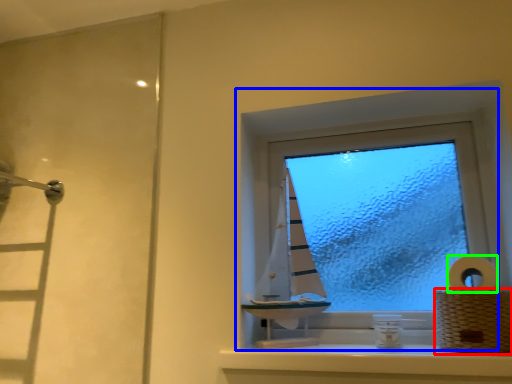
Question: Which is nearer to the basket (highlighted by a red box)? window (highlighted by a blue box) or toilet paper (highlighted by a green box).

Choices:
 (A) window
 (B) toilet paper

Answer: (B)